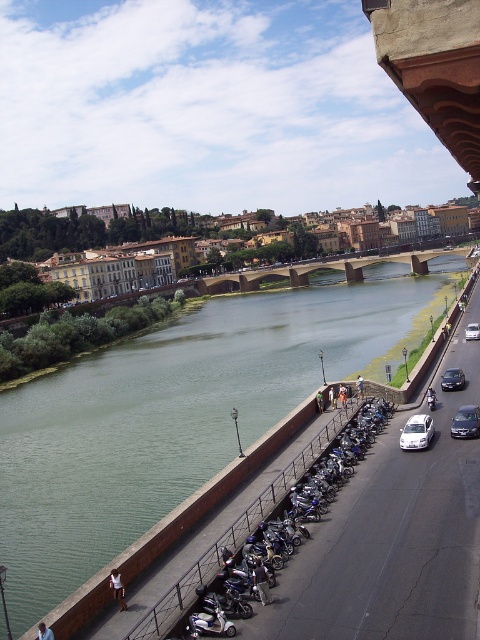
Question: Which object is positioned farthest from the shiny black sedan at right?

Choices:
 (A) green concrete river at center
 (B) white matte car at right

Answer: (A)

Question: Can you confirm if green concrete river at center is positioned above shiny silver sedan at right?

Choices:
 (A) no
 (B) yes

Answer: (B)

Question: Which object is the farthest from the shiny silver sedan at right?

Choices:
 (A) shiny black sedan at right
 (B) white matte car at right
 (C) white glossy car at center-right
 (D) brown stone bridge at center

Answer: (D)

Question: Is white matte car at right below shiny black sedan at right?

Choices:
 (A) no
 (B) yes

Answer: (B)

Question: Which point is farther to the camera?

Choices:
 (A) (456, 371)
 (B) (418, 436)

Answer: (A)

Question: Does green concrete river at center have a smaller size compared to shiny black sedan at right?

Choices:
 (A) no
 (B) yes

Answer: (A)